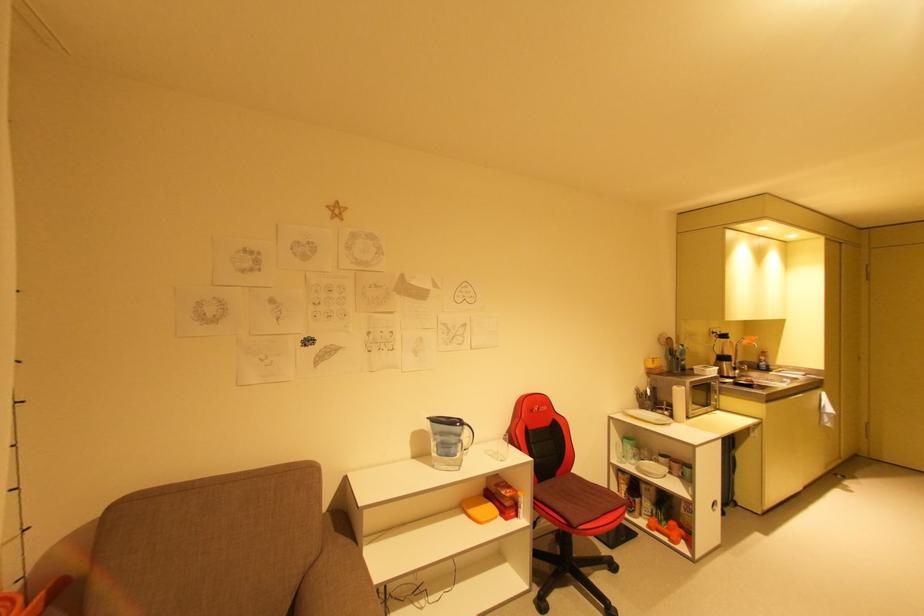
Identify the location of water pitcher handle. The width and height of the screenshot is (924, 616). (462, 428).